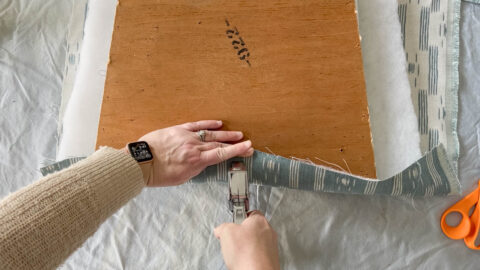
Identify the location of wrinkled white drop cloth. (155, 239).